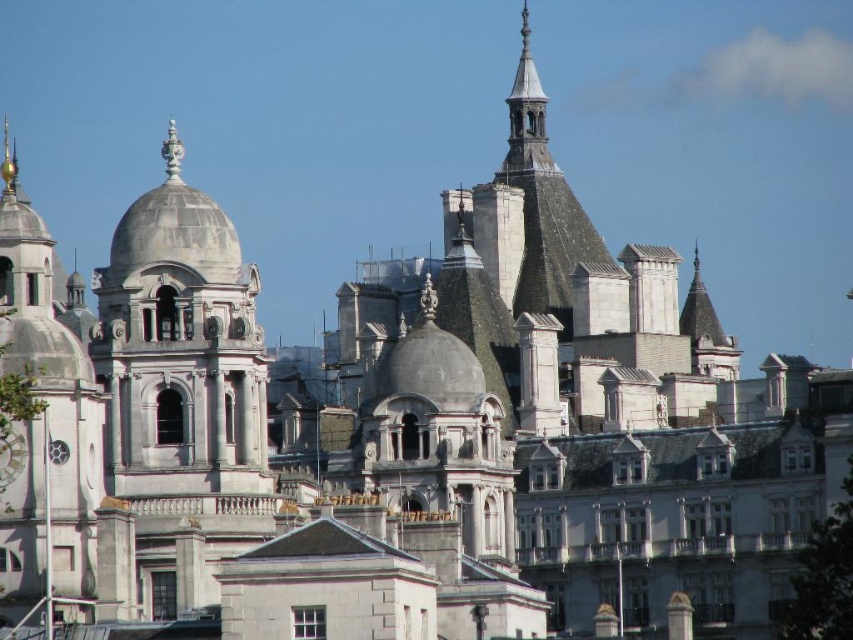
You are standing at the entrance of the historic cityscape and want to find the white stone clock tower at left. According to the coordinates provided, in which direction should you look to locate it?

The white stone clock tower at left is located at coordinates point (45, 428). Since the x coordinate is 0.670, which is closer to the right side, and the y coordinate 0.054 is near the bottom, you should look to your lower right direction to find it.

You are an architect analyzing the layout of this historic cityscape. You notice a point at coordinates (45, 428). Based on the scene description, what architectural feature does this point most likely correspond to?

The point at coordinates (45, 428) most likely corresponds to the white stone clock tower at left, as it is the only feature mentioned in the scene description that matches the coordinates provided.